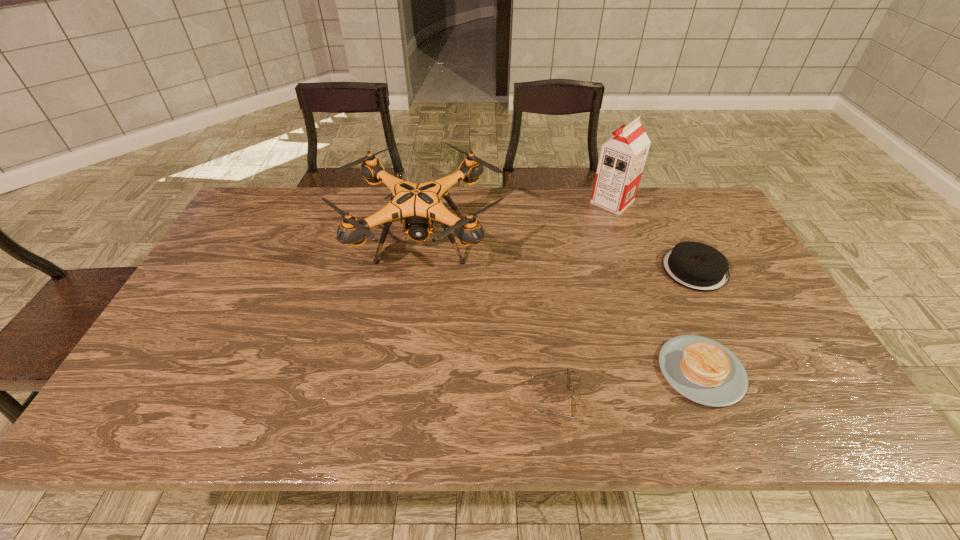
Where is `vacant space located 0.210m on the front-facing side of the spectacles`? Image resolution: width=960 pixels, height=540 pixels. vacant space located 0.210m on the front-facing side of the spectacles is located at coordinates (437, 399).

You are a GUI agent. You are given a task and a screenshot of the screen. Output one action in this format:
    pyautogui.click(x=<x>, y=<y>)
    Task: Click on the blank space located on the front-facing side of the spectacles
    This screenshot has height=540, width=960.
    Given the screenshot: What is the action you would take?
    pyautogui.click(x=464, y=399)

Find the location of a particular element. This screenshot has width=960, height=540. free region located 0.380m on the front-facing side of the spectacles is located at coordinates (359, 399).

Find the location of a particular element. The width and height of the screenshot is (960, 540). soya milk that is at the far edge is located at coordinates (622, 158).

At what (x,y) coordinates should I click in order to perform the action: click on drone that is at the far edge. Please return your answer as a coordinate pair (x, y). Looking at the image, I should click on (418, 204).

I want to click on pancake present at the near edge, so click(701, 369).

Find the location of a particular element. Image resolution: width=960 pixels, height=540 pixels. spectacles positioned at the near edge is located at coordinates (573, 405).

The width and height of the screenshot is (960, 540). Identify the location of object that is at the right edge. (694, 265).

I want to click on free space at the far edge of the desktop, so click(516, 220).

In the image, there is a desktop. Where is `vacant space at the near edge`? vacant space at the near edge is located at coordinates (471, 428).